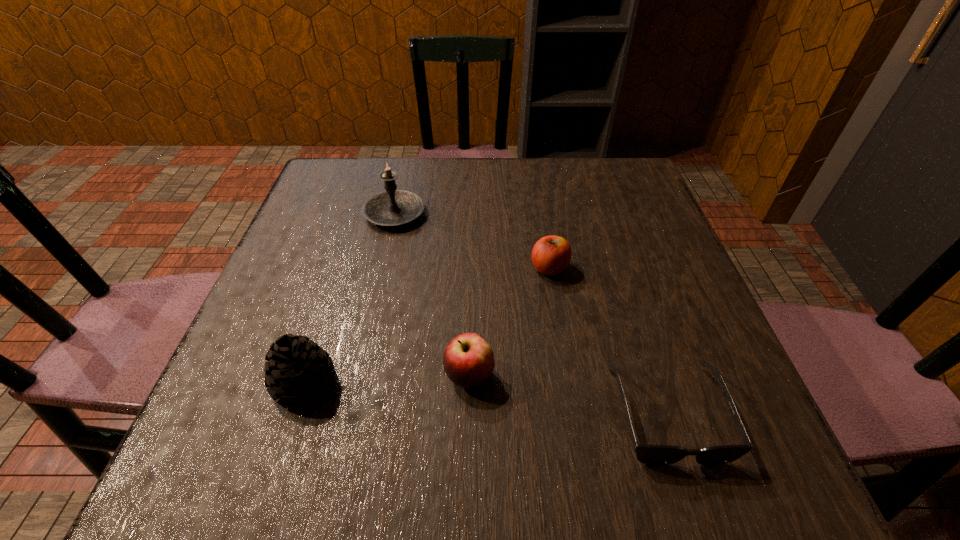
The image size is (960, 540). In order to click on vacant space at the far edge of the desktop in this screenshot , I will do `click(544, 182)`.

In the image, there is a desktop. Identify the location of free space at the near edge. Image resolution: width=960 pixels, height=540 pixels. (337, 478).

Locate an element on the screen. The height and width of the screenshot is (540, 960). vacant space at the left edge of the desktop is located at coordinates (365, 225).

Where is `vacant region at the far left corner of the desktop`? The height and width of the screenshot is (540, 960). vacant region at the far left corner of the desktop is located at coordinates (x=352, y=193).

Where is `vacant region at the far right corner of the desktop`? The width and height of the screenshot is (960, 540). vacant region at the far right corner of the desktop is located at coordinates (585, 190).

You are a GUI agent. You are given a task and a screenshot of the screen. Output one action in this format:
    pyautogui.click(x=<x>, y=<y>)
    Task: Click on the vacant space at the near right corner of the desktop
    The width and height of the screenshot is (960, 540).
    Given the screenshot: What is the action you would take?
    pyautogui.click(x=734, y=431)

Identify the location of free space between the sunglasses and the candle. The width and height of the screenshot is (960, 540). (531, 313).

Where is `vacant area between the shortest object and the left apple`? The width and height of the screenshot is (960, 540). vacant area between the shortest object and the left apple is located at coordinates (568, 394).

I want to click on vacant area that lies between the nearer apple and the tallest object, so click(x=432, y=294).

This screenshot has width=960, height=540. In order to click on blank region between the rightmost object and the second farthest object in this screenshot , I will do `click(608, 340)`.